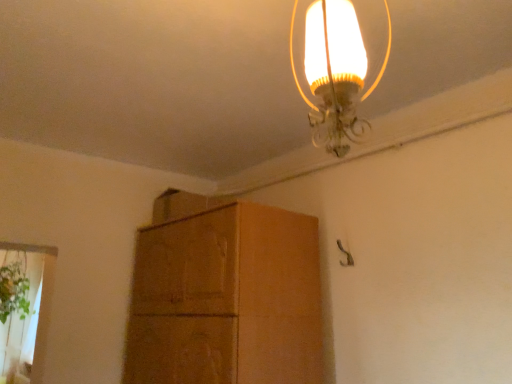
Question: Can you confirm if green leafy plant at lower left is thinner than translucent glass lampshade at upper center?

Choices:
 (A) yes
 (B) no

Answer: (B)

Question: Considering the relative sizes of green leafy plant at lower left and translucent glass lampshade at upper center in the image provided, is green leafy plant at lower left taller than translucent glass lampshade at upper center?

Choices:
 (A) yes
 (B) no

Answer: (A)

Question: Is green leafy plant at lower left positioned in front of translucent glass lampshade at upper center?

Choices:
 (A) no
 (B) yes

Answer: (A)

Question: Can you confirm if green leafy plant at lower left is bigger than translucent glass lampshade at upper center?

Choices:
 (A) yes
 (B) no

Answer: (A)

Question: From the image's perspective, is green leafy plant at lower left below translucent glass lampshade at upper center?

Choices:
 (A) no
 (B) yes

Answer: (B)

Question: In terms of width, does brown cardboard cabinet at center look wider or thinner when compared to green leafy plant at lower left?

Choices:
 (A) thin
 (B) wide

Answer: (A)

Question: From the image's perspective, is brown cardboard cabinet at center above or below green leafy plant at lower left?

Choices:
 (A) below
 (B) above

Answer: (B)

Question: Is brown cardboard cabinet at center inside the boundaries of green leafy plant at lower left, or outside?

Choices:
 (A) inside
 (B) outside

Answer: (B)

Question: Does point (243, 375) appear closer or farther from the camera than point (14, 266)?

Choices:
 (A) farther
 (B) closer

Answer: (B)

Question: Is green leafy plant at lower left taller or shorter than brown cardboard cabinet at center?

Choices:
 (A) tall
 (B) short

Answer: (B)

Question: From a real-world perspective, is green leafy plant at lower left physically located above or below brown cardboard cabinet at center?

Choices:
 (A) below
 (B) above

Answer: (B)

Question: In terms of width, does green leafy plant at lower left look wider or thinner when compared to brown cardboard cabinet at center?

Choices:
 (A) thin
 (B) wide

Answer: (B)

Question: Is green leafy plant at lower left inside or outside of brown cardboard cabinet at center?

Choices:
 (A) outside
 (B) inside

Answer: (A)

Question: From the image's perspective, relative to green leafy plant at lower left, is translucent glass lampshade at upper center above or below?

Choices:
 (A) above
 (B) below

Answer: (A)

Question: Is translucent glass lampshade at upper center wider or thinner than green leafy plant at lower left?

Choices:
 (A) wide
 (B) thin

Answer: (B)